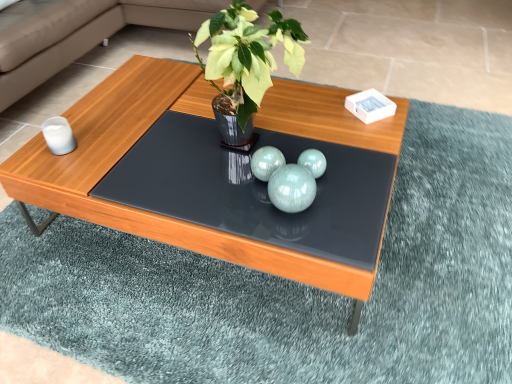
Find the location of `free region on the left part of teal glossy spheres at center`. free region on the left part of teal glossy spheres at center is located at coordinates (228, 199).